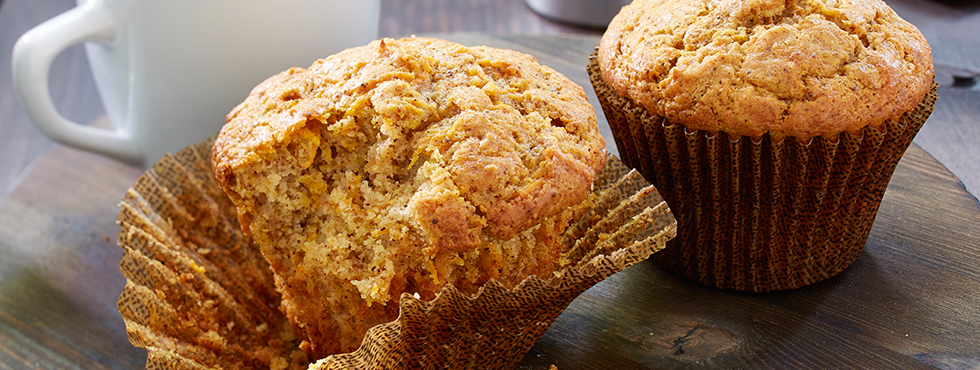
Find the location of `handle`. handle is located at coordinates (36, 53).